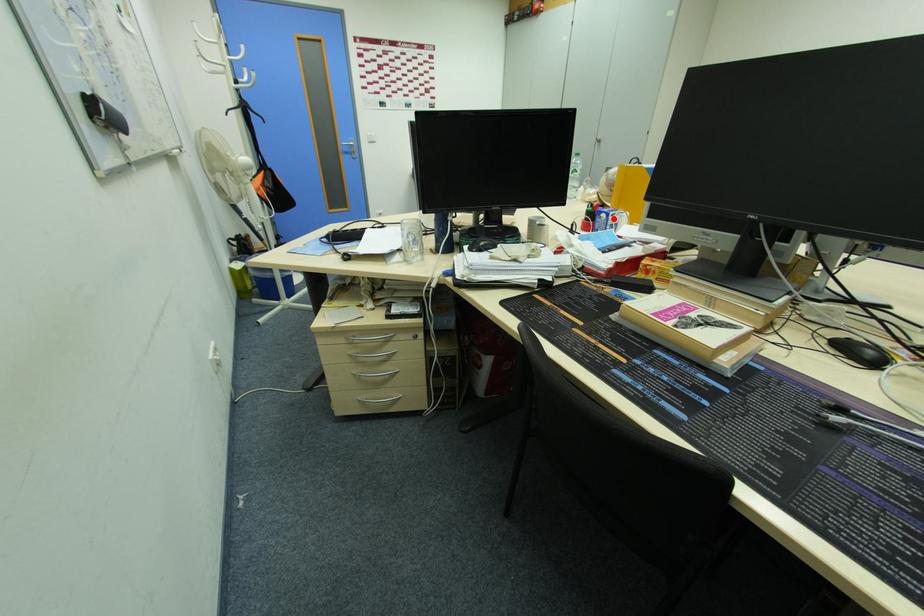
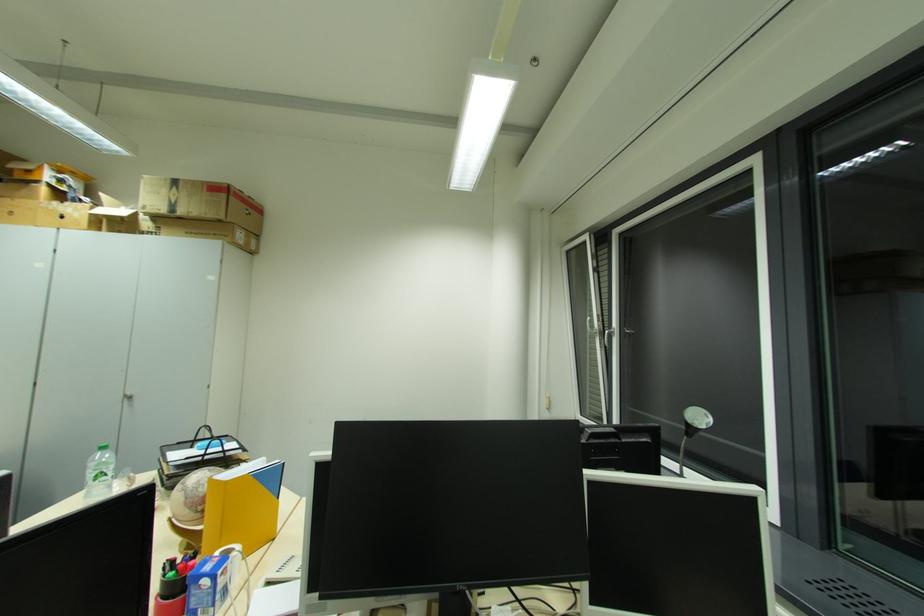
Where in the second image is the point corresponding to the highlighted location from the first image?

(223, 582)